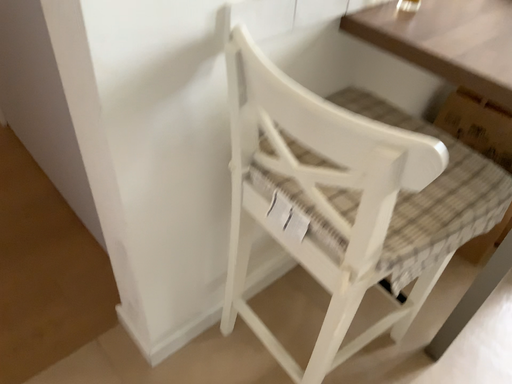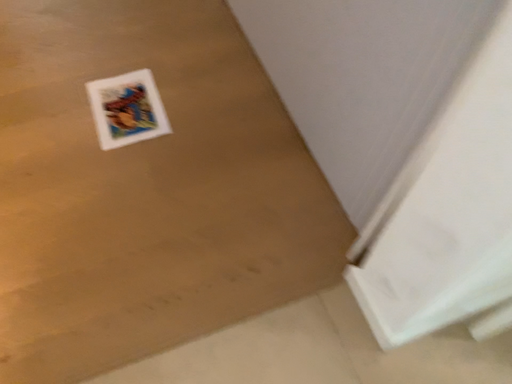
Question: How did the camera likely rotate when shooting the video?

Choices:
 (A) rotated downward
 (B) rotated upward

Answer: (A)